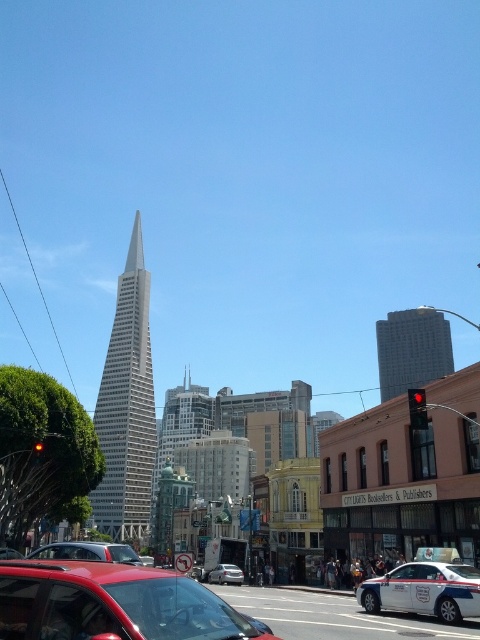
You are a pedestrian standing at the intersection and see the glass skyscraper at center and the red glass traffic light at left. Which object is closer to your right side?

The red glass traffic light at left is closer to your right side because the glass skyscraper at center is positioned on the left side of it.

In the scene shown: You are a pedestrian standing at the crosswalk and see the white glossy police car at lower right and the red glass traffic light at left. Which object is closer to the crosswalk?

The red glass traffic light at left is closer to the crosswalk because the white glossy police car at lower right is positioned on the right side of it, meaning the traffic light is between the pedestrian and the police car.

In the scene shown: You are standing at the intersection and want to take a photo of the Transamerica Pyramid building. There is a glass skyscraper at center blocking your view. Can you move to the point at coordinates point (127, 406) to get an unobstructed view?

The point at coordinates point (127, 406) corresponds to the glass skyscraper at center, so moving there would not provide an unobstructed view of the Transamerica Pyramid building as it is blocked by the glass skyscraper itself.